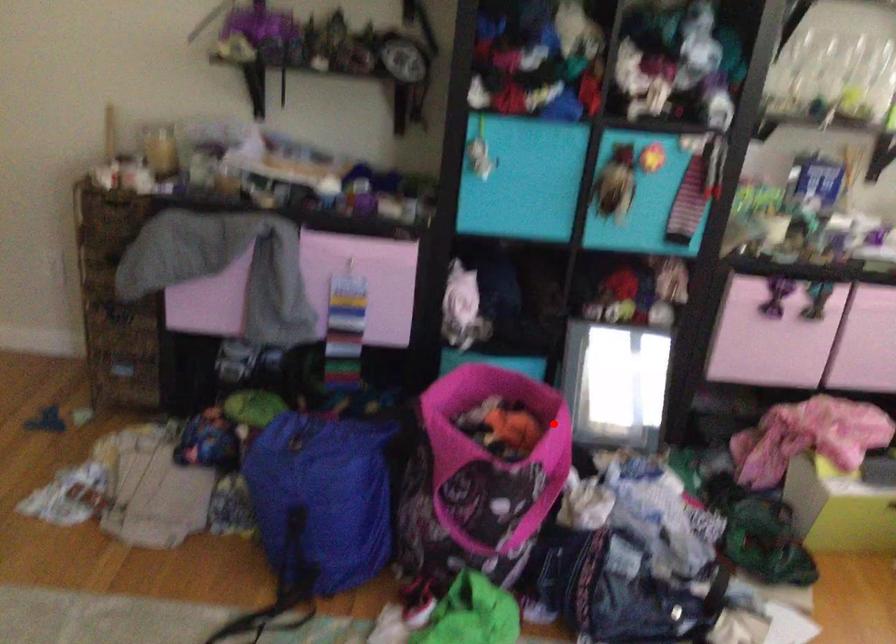
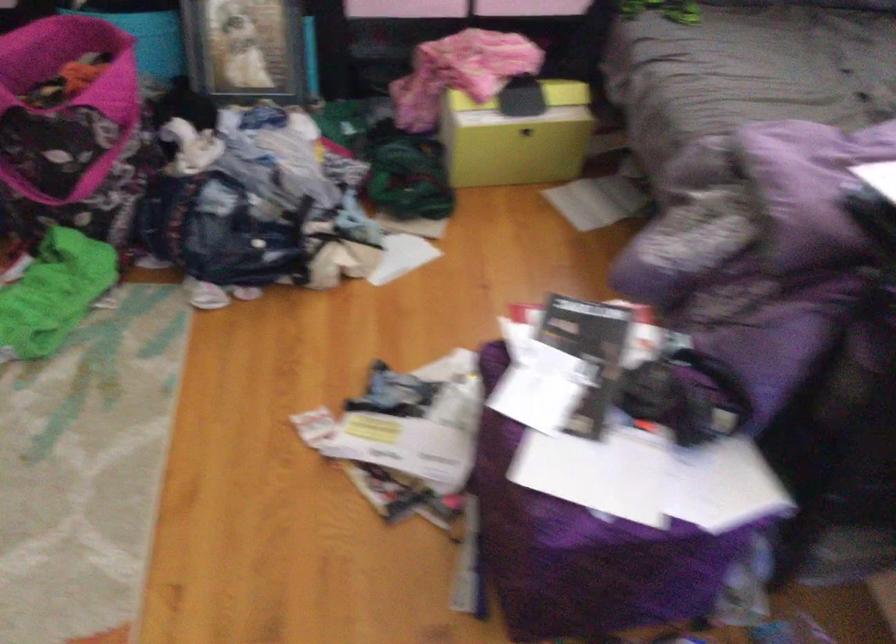
The point at the highlighted location is marked in the first image. Where is the corresponding point in the second image?

(124, 67)